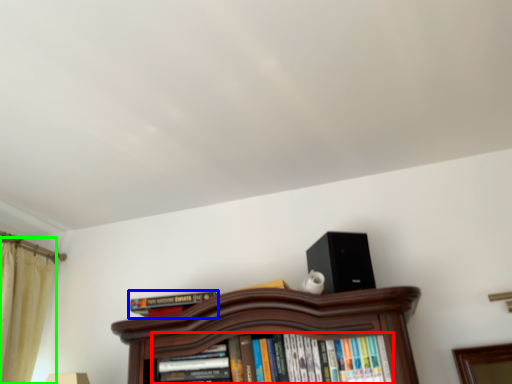
Question: Based on their relative distances, which object is farther from book (highlighted by a red box)? Choose from book (highlighted by a blue box) and curtain (highlighted by a green box).

Choices:
 (A) book
 (B) curtain

Answer: (B)